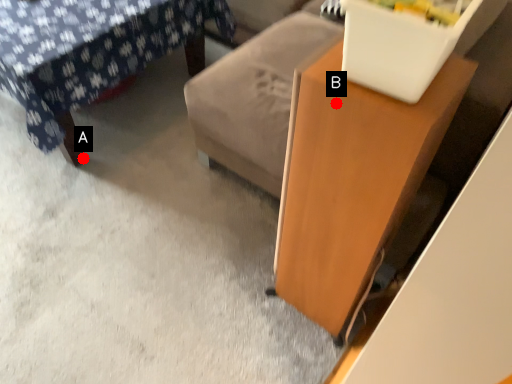
Question: Two points are circled on the image, labeled by A and B beside each circle. Which point is farther to the camera?

Choices:
 (A) A is further
 (B) B is further

Answer: (A)